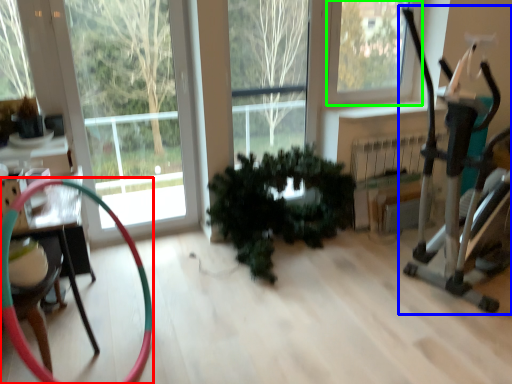
Question: Which object is positioned closest to garden hose (highlighted by a red box)? Select from baby carriage (highlighted by a blue box) and window (highlighted by a green box).

Choices:
 (A) baby carriage
 (B) window

Answer: (A)